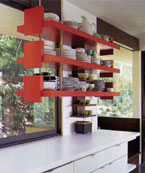
Locate an element on the screen. This screenshot has height=173, width=145. ceiliing is located at coordinates (120, 4).